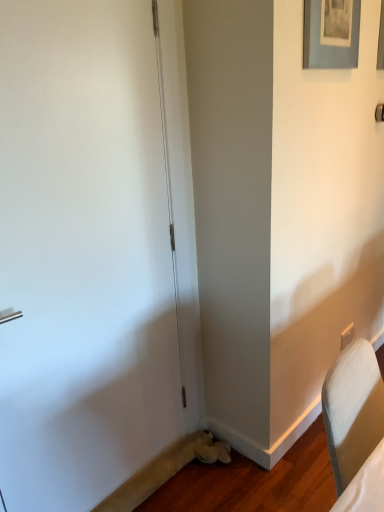
Question: Is white matte door at left further to the viewer compared to matte gray picture frame at upper right?

Choices:
 (A) yes
 (B) no

Answer: (B)

Question: From a real-world perspective, is white matte door at left over matte gray picture frame at upper right?

Choices:
 (A) no
 (B) yes

Answer: (A)

Question: Is white matte door at left far from matte gray picture frame at upper right?

Choices:
 (A) yes
 (B) no

Answer: (B)

Question: Considering the relative sizes of white matte door at left and matte gray picture frame at upper right in the image provided, is white matte door at left bigger than matte gray picture frame at upper right?

Choices:
 (A) yes
 (B) no

Answer: (A)

Question: Can you confirm if white matte door at left is thinner than matte gray picture frame at upper right?

Choices:
 (A) yes
 (B) no

Answer: (B)

Question: Can you confirm if white matte door at left is positioned to the left of matte gray picture frame at upper right?

Choices:
 (A) yes
 (B) no

Answer: (A)

Question: Can you confirm if beige plastic electric outlet at lower right is shorter than white matte door at left?

Choices:
 (A) no
 (B) yes

Answer: (B)

Question: Can you confirm if beige plastic electric outlet at lower right is taller than white matte door at left?

Choices:
 (A) no
 (B) yes

Answer: (A)

Question: Does beige plastic electric outlet at lower right have a greater width compared to white matte door at left?

Choices:
 (A) no
 (B) yes

Answer: (A)

Question: Is white matte door at left a part of beige plastic electric outlet at lower right?

Choices:
 (A) yes
 (B) no

Answer: (B)

Question: From a real-world perspective, is beige plastic electric outlet at lower right physically below white matte door at left?

Choices:
 (A) no
 (B) yes

Answer: (B)

Question: Is there a large distance between beige plastic electric outlet at lower right and white matte door at left?

Choices:
 (A) no
 (B) yes

Answer: (B)

Question: Does matte gray picture frame at upper right appear on the left side of beige plastic electric outlet at lower right?

Choices:
 (A) yes
 (B) no

Answer: (A)